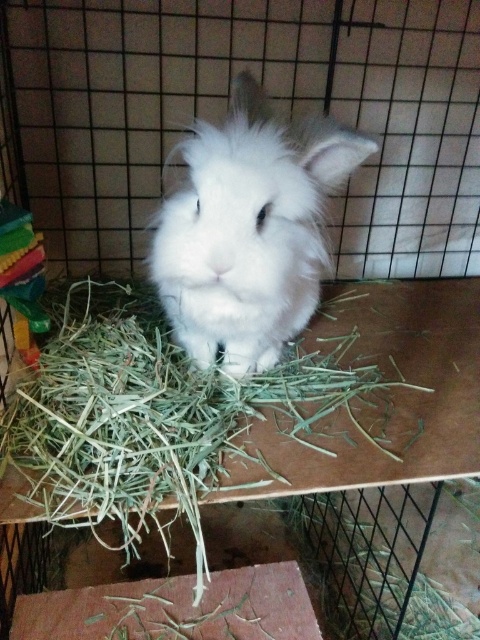
You are a pet owner who wants to ensure the white fluffy rabbit at center has enough space to move around in its enclosure. Given that the green straw at center takes up a significant portion of the enclosure, can you determine if the rabbit has enough space to move freely?

The green straw at center is larger in size than the white fluffy rabbit at center, which means the straw occupies more space. However, since the rabbit is at the center, it might still have some room to move around, but the enclosure may be cramped due to the large amount of straw.

You are a small toy mouse that wants to roll from the green straw at center to the white fluffy rabbit at center. Can you reach the rabbit without crossing the cage bars?

The green straw at center is to the left of white fluffy rabbit at center, so the toy mouse can roll from the green straw at center to the white fluffy rabbit at center without crossing the cage bars as they are both on the wooden platform inside the cage.